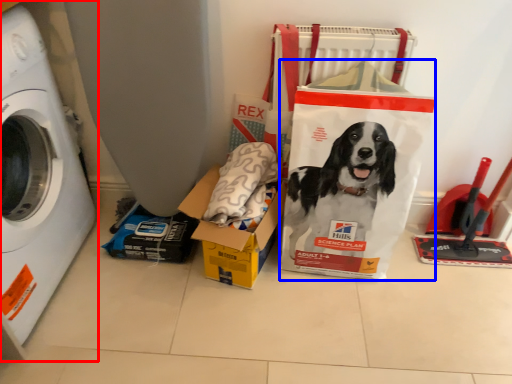
Question: Which of the following is the farthest to the observer, washing machine (highlighted by a red box) or paper bag (highlighted by a blue box)?

Choices:
 (A) washing machine
 (B) paper bag

Answer: (B)